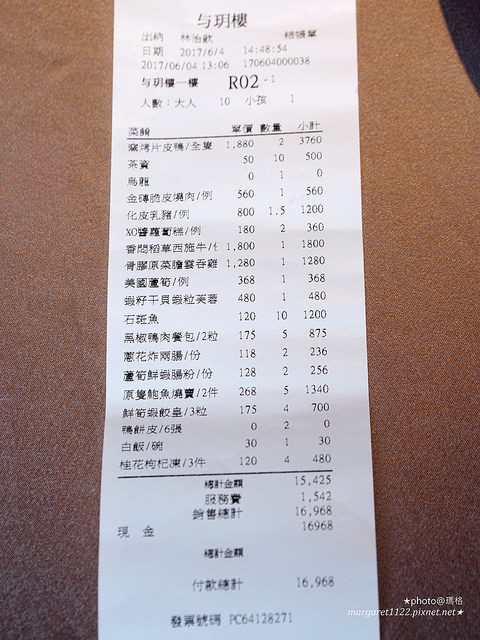
Where is `table`? table is located at coordinates (439, 230).